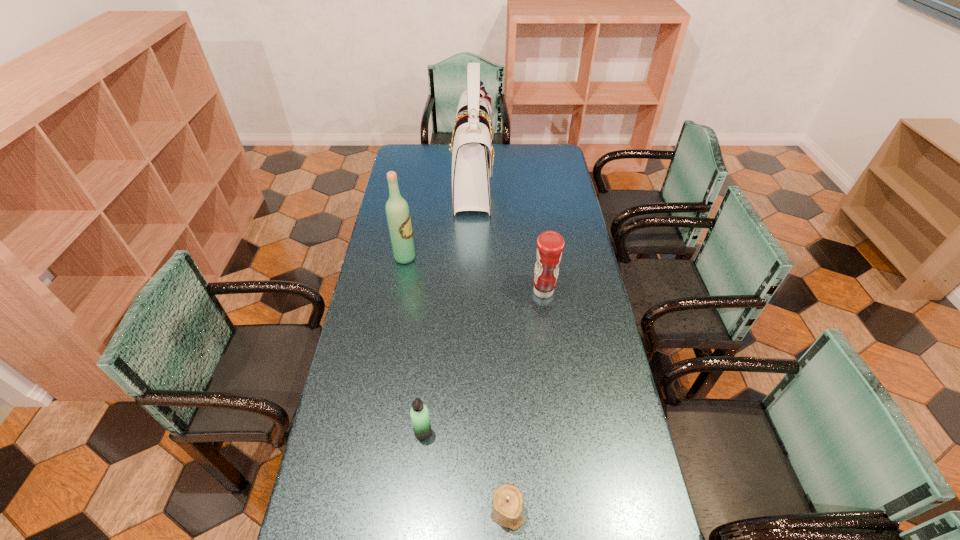
Find the location of a particular element. The image size is (960, 540). free space between the second nearest object and the tallest object is located at coordinates (447, 307).

The height and width of the screenshot is (540, 960). Identify the location of empty location between the condiment and the fourth farthest object. (483, 362).

I want to click on vacant area that lies between the rightmost object and the candle_holder, so click(525, 402).

Identify the location of free area in between the tallest object and the candle_holder. (490, 347).

Where is `empty space between the farthest object and the candle_holder`? empty space between the farthest object and the candle_holder is located at coordinates (490, 347).

Locate an element on the screen. free space between the leftmost object and the condiment is located at coordinates (474, 274).

Locate an element on the screen. The height and width of the screenshot is (540, 960). blank region between the candle_holder and the satchel is located at coordinates (490, 347).

The height and width of the screenshot is (540, 960). In order to click on vacant area between the condiment and the tallest object in this screenshot , I will do [508, 237].

Find the location of a particular element. empty space between the nearest object and the third nearest object is located at coordinates (525, 402).

Where is `blank region between the third nearest object and the second farthest object`? The width and height of the screenshot is (960, 540). blank region between the third nearest object and the second farthest object is located at coordinates (474, 274).